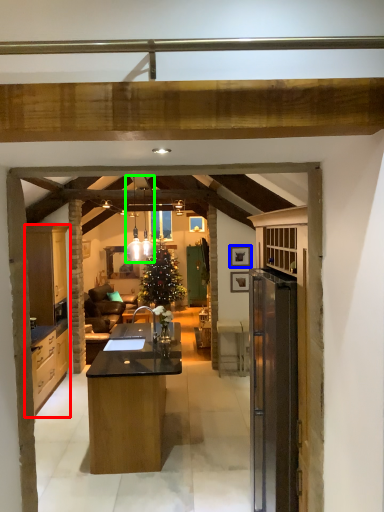
Question: Estimate the real-world distances between objects in this image. Which object is closer to cabinetry (highlighted by a red box), picture frame (highlighted by a blue box) or lamp (highlighted by a green box)?

Choices:
 (A) picture frame
 (B) lamp

Answer: (B)